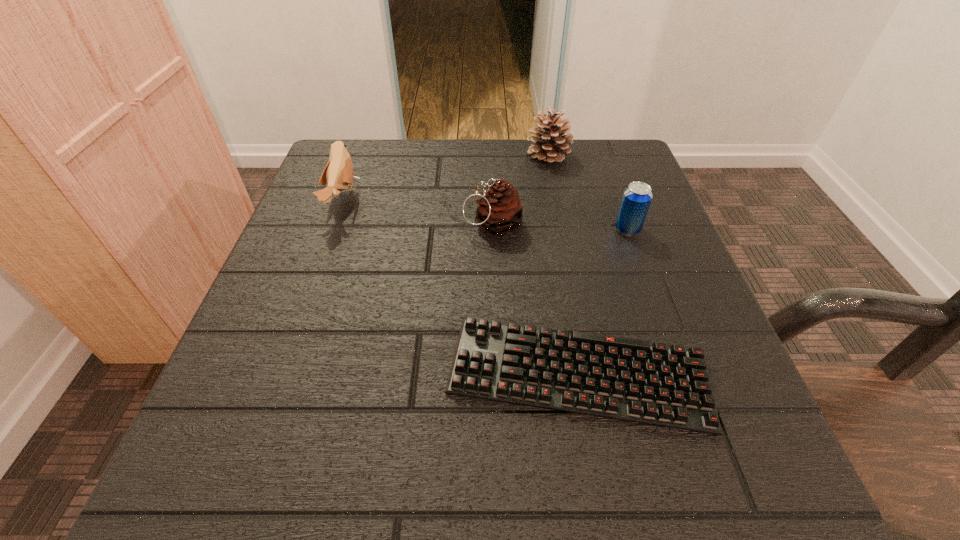
The image size is (960, 540). What are the coordinates of `the farthest object` in the screenshot? It's located at (550, 146).

You are a GUI agent. You are given a task and a screenshot of the screen. Output one action in this format:
    pyautogui.click(x=<x>, y=<y>)
    Task: Click on the farther pinecone
    This screenshot has width=960, height=540.
    Given the screenshot: What is the action you would take?
    pyautogui.click(x=550, y=146)

Locate an element on the screen. This screenshot has width=960, height=540. the nearer pinecone is located at coordinates (500, 210).

Find the location of a particular element. This screenshot has width=960, height=540. bird is located at coordinates (338, 174).

Where is `beer can`? beer can is located at coordinates (636, 199).

Identify the location of the shortest object. (627, 379).

The image size is (960, 540). Identify the location of computer keyboard. (627, 379).

Locate an element on the screen. The height and width of the screenshot is (540, 960). vacant region located on the right of the farther pinecone is located at coordinates (614, 156).

Find the location of a particular element. The height and width of the screenshot is (540, 960). free space located with a leaf charm attached to the nearer pinecone is located at coordinates (375, 225).

Locate an element on the screen. free space located 0.070m with a leaf charm attached to the nearer pinecone is located at coordinates (427, 225).